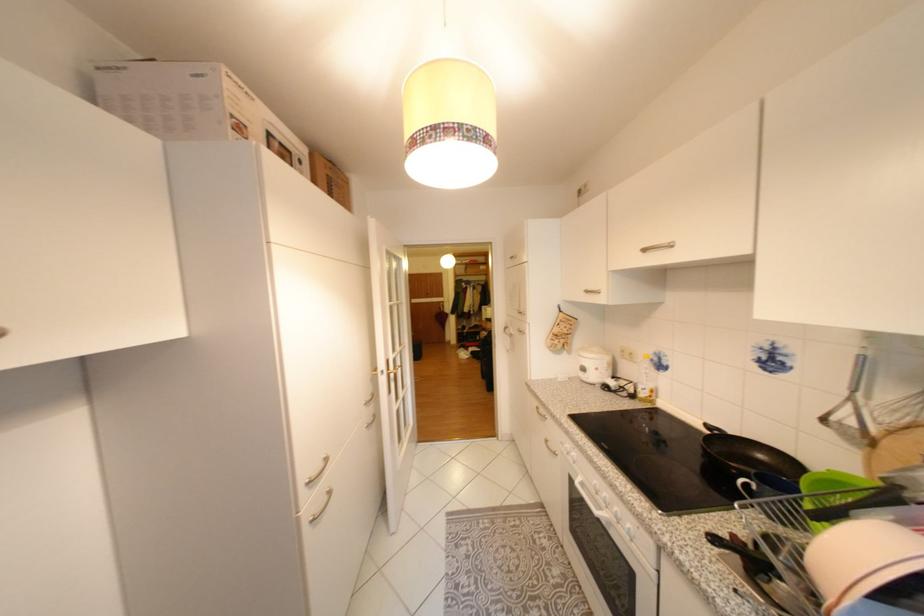
Locate an element on the screen. This screenshot has height=616, width=924. white oven dial is located at coordinates (629, 532).